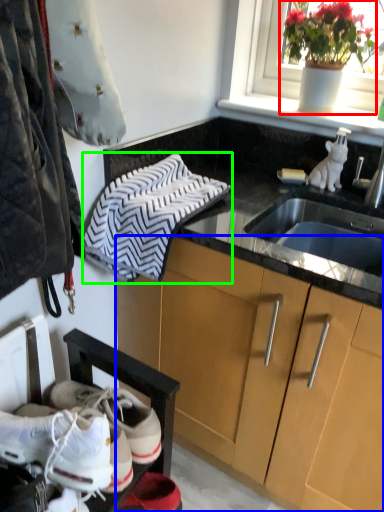
Question: Which is nearer to the houseplant (highlighted by a red box)? cabinetry (highlighted by a blue box) or hand towel (highlighted by a green box).

Choices:
 (A) cabinetry
 (B) hand towel

Answer: (B)